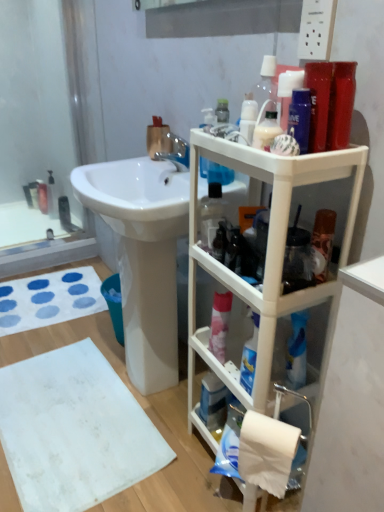
Question: From the image's perspective, is blue plastic mouthwash at lower center beneath white matte toilet paper at lower right?

Choices:
 (A) yes
 (B) no

Answer: (A)

Question: Can you confirm if blue plastic mouthwash at lower center is wider than white matte toilet paper at lower right?

Choices:
 (A) no
 (B) yes

Answer: (A)

Question: Is blue plastic mouthwash at lower center placed right next to white matte toilet paper at lower right?

Choices:
 (A) yes
 (B) no

Answer: (B)

Question: Does blue plastic mouthwash at lower center have a smaller size compared to white matte toilet paper at lower right?

Choices:
 (A) yes
 (B) no

Answer: (A)

Question: From the image's perspective, does blue plastic mouthwash at lower center appear higher than white matte toilet paper at lower right?

Choices:
 (A) no
 (B) yes

Answer: (A)

Question: From a real-world perspective, is blue plastic mouthwash at lower center physically above white matte toilet paper at lower right?

Choices:
 (A) no
 (B) yes

Answer: (A)

Question: Is white matte toilet paper at lower right smaller than chrome metallic faucet at upper center?

Choices:
 (A) no
 (B) yes

Answer: (A)

Question: Is the depth of white matte toilet paper at lower right greater than that of chrome metallic faucet at upper center?

Choices:
 (A) yes
 (B) no

Answer: (B)

Question: Can you confirm if white matte toilet paper at lower right is taller than chrome metallic faucet at upper center?

Choices:
 (A) no
 (B) yes

Answer: (B)

Question: From a real-world perspective, is white matte toilet paper at lower right on top of chrome metallic faucet at upper center?

Choices:
 (A) yes
 (B) no

Answer: (B)

Question: Is white matte toilet paper at lower right in front of chrome metallic faucet at upper center?

Choices:
 (A) yes
 (B) no

Answer: (A)

Question: Does white matte toilet paper at lower right have a larger size compared to chrome metallic faucet at upper center?

Choices:
 (A) no
 (B) yes

Answer: (B)

Question: Does white plastic shelf at right have a larger size compared to translucent plastic bottle at upper center?

Choices:
 (A) no
 (B) yes

Answer: (B)